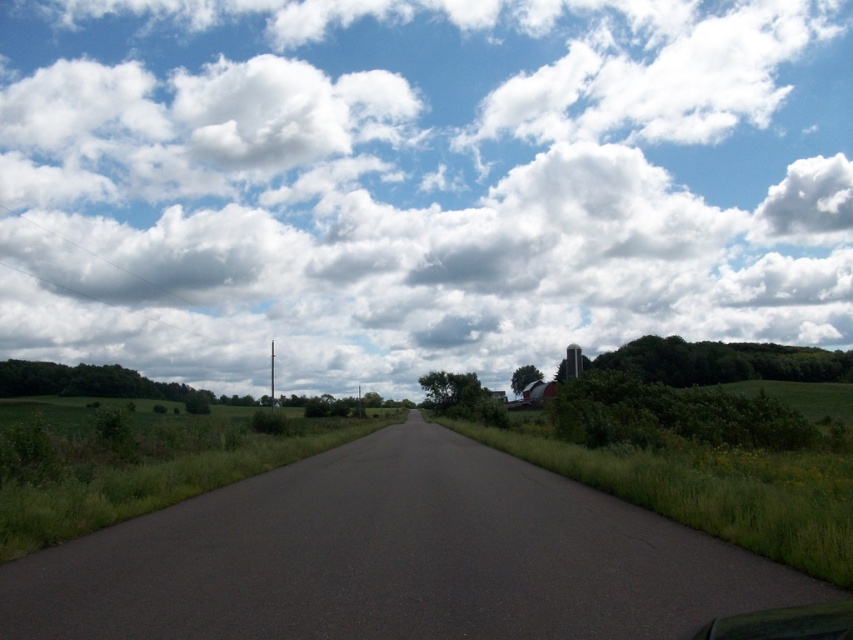
Question: Can you confirm if dark asphalt road at center is wider than green grass at left?

Choices:
 (A) no
 (B) yes

Answer: (A)

Question: Is dark asphalt road at center to the right of green grass at left from the viewer's perspective?

Choices:
 (A) no
 (B) yes

Answer: (B)

Question: Which of the following is the farthest from the observer?

Choices:
 (A) (763, 637)
 (B) (297, 56)
 (C) (140, 467)

Answer: (B)

Question: Which object appears farthest from the camera in this image?

Choices:
 (A) green matte car at lower right
 (B) white fluffy cloud at upper center
 (C) green grass at left

Answer: (B)

Question: Which of the following is the closest to the observer?

Choices:
 (A) (225, 588)
 (B) (796, 72)
 (C) (35, 476)

Answer: (A)

Question: Is the position of white fluffy cloud at upper center less distant than that of green grass at left?

Choices:
 (A) no
 (B) yes

Answer: (A)